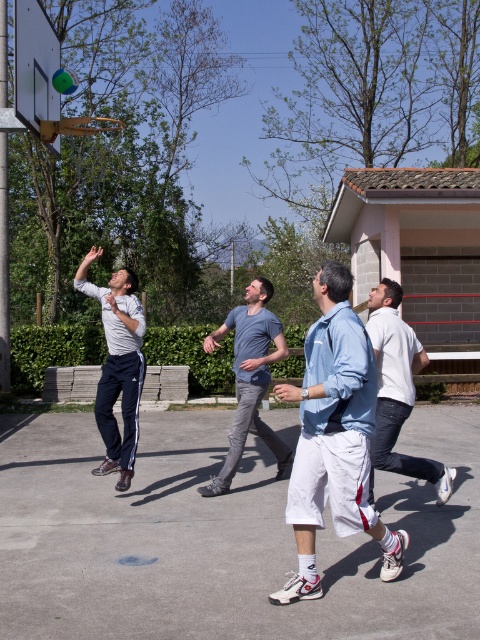
Question: Can you confirm if matte gray sweatshirt at left is positioned above metallic silver basketball hoop at upper left?

Choices:
 (A) yes
 (B) no

Answer: (B)

Question: Among these objects, which one is nearest to the camera?

Choices:
 (A) light blue denim shorts at center
 (B) white cotton shirt at right

Answer: (A)

Question: Which point appears closest to the camera in this image?

Choices:
 (A) (313, 624)
 (B) (365, 371)

Answer: (A)

Question: Is white cotton shorts at center below white cotton shirt at right?

Choices:
 (A) no
 (B) yes

Answer: (B)

Question: In this image, where is white cotton shorts at center located relative to white cotton shirt at right?

Choices:
 (A) below
 (B) above

Answer: (A)

Question: Which object appears farthest from the camera in this image?

Choices:
 (A) light blue denim shorts at center
 (B) matte gray sweatshirt at left

Answer: (B)